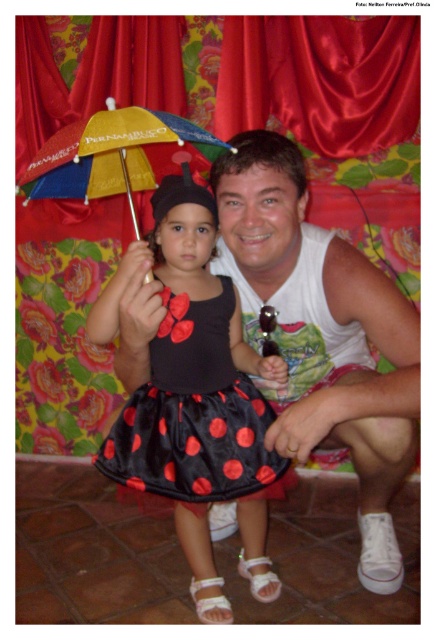
You are a photographer setting up for a photoshoot. You need to ensure that the white cotton tank top at center and the black satin dress at center are positioned so that they are at least 8 inches apart. Based on the current setup, is this requirement met?

The white cotton tank top at center is 7.34 inches away from the black satin dress at center, which is less than the required 8 inches. Therefore, the requirement is not met.

You are a photographer setting up a shoot in the described scene. You need to adjust the lighting so that both the black satin dress at center and the multicolored fabric umbrella at upper left are well illuminated. Considering their sizes, which object requires a wider light source to properly capture its full height?

The black satin dress at center requires a wider light source because it has a greater height compared to the multicolored fabric umbrella at upper left.